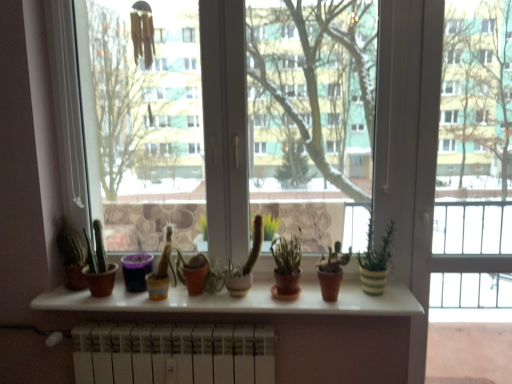
The image size is (512, 384). I want to click on matte terracotta pot at center, the 2th flowerpot when ordered from left to right, so click(195, 278).

In order to face white glossy window sill at center, should I rotate leftwards or rightwards?

You should rotate left by 4.370 degrees.

What do you see at coordinates (244, 265) in the screenshot? The width and height of the screenshot is (512, 384). I see `green matte cactus at center, which is counted as the 3th houseplant, starting from the left` at bounding box center [244, 265].

Identify the location of matte brown cactus at left, acting as the 5th houseplant starting from the right. [x=98, y=265].

From the image's perspective, is white matte radiator at lower center located beneath matte brown cactus at left, arranged as the sixth houseplant when viewed from the right?

Yes, from the image's perspective, white matte radiator at lower center is below matte brown cactus at left, arranged as the sixth houseplant when viewed from the right.

Considering the positions of objects white matte radiator at lower center and matte brown cactus at left, arranged as the sixth houseplant when viewed from the right, in the image provided, who is more to the left, white matte radiator at lower center or matte brown cactus at left, arranged as the sixth houseplant when viewed from the right,?

Positioned to the left is matte brown cactus at left, arranged as the sixth houseplant when viewed from the right.

Looking at this image, which point is more distant from viewer, (144, 353) or (69, 259)?

The point (69, 259) is behind.

Relative to matte brown cactus at left, acting as the 1th houseplant starting from the left, is white matte radiator at lower center in front or behind?

Visually, white matte radiator at lower center is located in front of matte brown cactus at left, acting as the 1th houseplant starting from the left.

Is white glossy window sill at center directly adjacent to matte brown cactus at left, acting as the 1th houseplant starting from the left?

white glossy window sill at center and matte brown cactus at left, acting as the 1th houseplant starting from the left, are not in contact.

Considering the relative sizes of white glossy window sill at center and matte brown cactus at left, acting as the 1th houseplant starting from the left, in the image provided, is white glossy window sill at center smaller than matte brown cactus at left, acting as the 1th houseplant starting from the left,?

Actually, white glossy window sill at center might be larger than matte brown cactus at left, acting as the 1th houseplant starting from the left.

Considering the relative sizes of white glossy window sill at center and matte brown cactus at left, arranged as the sixth houseplant when viewed from the right, in the image provided, is white glossy window sill at center shorter than matte brown cactus at left, arranged as the sixth houseplant when viewed from the right,?

Indeed, white glossy window sill at center has a lesser height compared to matte brown cactus at left, arranged as the sixth houseplant when viewed from the right.

Is transparent glass window at center wider or thinner than terracotta clay pot at center, which ranks as the second houseplant in right-to-left order?

In the image, transparent glass window at center appears to be more narrow than terracotta clay pot at center, which ranks as the second houseplant in right-to-left order.

Considering the relative positions of transparent glass window at center and terracotta clay pot at center, which ranks as the second houseplant in right-to-left order, in the image provided, is transparent glass window at center to the right of terracotta clay pot at center, which ranks as the second houseplant in right-to-left order, from the viewer's perspective?

Incorrect, transparent glass window at center is not on the right side of terracotta clay pot at center, which ranks as the second houseplant in right-to-left order.

Is transparent glass window at center beside terracotta clay pot at center, which is the 5th houseplant from left to right?

No.

Considering the sizes of transparent glass window at center and matte brown cactus at left, acting as the 5th houseplant starting from the right, in the image, is transparent glass window at center taller or shorter than matte brown cactus at left, acting as the 5th houseplant starting from the right,?

Considering their sizes, transparent glass window at center has more height than matte brown cactus at left, acting as the 5th houseplant starting from the right.

From the image's perspective, who appears lower, transparent glass window at center or matte brown cactus at left, acting as the 5th houseplant starting from the right?

matte brown cactus at left, acting as the 5th houseplant starting from the right, is shown below in the image.

How far apart are transparent glass window at center and matte brown cactus at left, acting as the 5th houseplant starting from the right?

transparent glass window at center and matte brown cactus at left, acting as the 5th houseplant starting from the right, are 22.10 inches apart from each other.

Would you consider transparent glass window at center to be distant from matte brown cactus at left, acting as the 5th houseplant starting from the right?

No, transparent glass window at center is not far away from matte brown cactus at left, acting as the 5th houseplant starting from the right.

Between point (254, 224) and point (59, 241), which one is positioned in front?

The point (59, 241) is more forward.

How many degrees apart are the facing directions of green matte cactus at center, which appears as the 4th houseplant when viewed from the right, and matte brown cactus at left, acting as the 1th houseplant starting from the left?

They differ by 3.57 degrees in their facing directions.

From the image's perspective, would you say green matte cactus at center, which is counted as the 3th houseplant, starting from the left, is positioned over matte brown cactus at left, acting as the 1th houseplant starting from the left?

No, from the image's perspective, green matte cactus at center, which is counted as the 3th houseplant, starting from the left, is not above matte brown cactus at left, acting as the 1th houseplant starting from the left.

From a real-world perspective, which is physically above, green matte cactus at center, which is counted as the 3th houseplant, starting from the left, or matte brown cactus at left, arranged as the sixth houseplant when viewed from the right?

green matte cactus at center, which is counted as the 3th houseplant, starting from the left, from a real-world perspective.

In the image, is matte terracotta pot at center, the 2th flowerpot when ordered from left to right, positioned in front of or behind matte brown cactus at left, the second houseplant positioned from the left?

Visually, matte terracotta pot at center, the 2th flowerpot when ordered from left to right, is located behind matte brown cactus at left, the second houseplant positioned from the left.

From the image's perspective, does matte terracotta pot at center, the 1th flowerpot from the right, appear lower than matte brown cactus at left, the second houseplant positioned from the left?

Correct, matte terracotta pot at center, the 1th flowerpot from the right, appears lower than matte brown cactus at left, the second houseplant positioned from the left, in the image.

There is a matte brown cactus at left, the second houseplant positioned from the left. What are the coordinates of `the 2nd flowerpot below it (from a real-world perspective)` in the screenshot? It's located at (195, 278).

In terms of width, does matte terracotta pot at center, the 1th flowerpot from the right, look wider or thinner when compared to matte brown cactus at left, acting as the 5th houseplant starting from the right?

matte terracotta pot at center, the 1th flowerpot from the right, is wider than matte brown cactus at left, acting as the 5th houseplant starting from the right.

From their relative heights in the image, would you say green matte cactus at center, which appears as the 4th houseplant when viewed from the right, is taller or shorter than transparent glass window at center?

Considering their sizes, green matte cactus at center, which appears as the 4th houseplant when viewed from the right, has less height than transparent glass window at center.

Measure the distance from green matte cactus at center, which is counted as the 3th houseplant, starting from the left, to transparent glass window at center.

green matte cactus at center, which is counted as the 3th houseplant, starting from the left, is 81.34 centimeters from transparent glass window at center.

From a real-world perspective, is green matte cactus at center, which is counted as the 3th houseplant, starting from the left, positioned above or below transparent glass window at center?

Result: From a real-world perspective, green matte cactus at center, which is counted as the 3th houseplant, starting from the left, is physically below transparent glass window at center.

Is the depth of green matte cactus at center, which appears as the 4th houseplant when viewed from the right, less than that of transparent glass window at center?

No, green matte cactus at center, which appears as the 4th houseplant when viewed from the right, is further to the viewer.

From the image's perspective, which houseplant is the 5th one above the white matte radiator at lower center? Please provide its 2D coordinates.

[(71, 254)]

Find the location of a particular element. The image size is (512, 384). window sill in front of the matte brown cactus at left, arranged as the sixth houseplant when viewed from the right is located at coordinates (239, 301).

Estimate the real-world distances between objects in this image. Which object is further from transparent glass window at center, white glossy window sill at center or matte terracotta pot at center, the 1th flowerpot from the right?

matte terracotta pot at center, the 1th flowerpot from the right, lies further to transparent glass window at center than the other object.

Which object lies further to the anchor point green matte cactus at center, the fourth houseplant in the left-to-right sequence, matte brown cactus at left, the second houseplant positioned from the left, or transparent glass window at center?

The object further to green matte cactus at center, the fourth houseplant in the left-to-right sequence, is transparent glass window at center.

From the image, which object appears to be nearer to matte brown cactus at left, acting as the 5th houseplant starting from the right, green matte cactus at center, which is counted as the 3th houseplant, starting from the left, or green matte cactus at center, the fourth houseplant in the left-to-right sequence?

green matte cactus at center, which is counted as the 3th houseplant, starting from the left, is positioned closer to the anchor matte brown cactus at left, acting as the 5th houseplant starting from the right.

Looking at the image, which one is located further to white glossy window sill at center, transparent glass window at center or terracotta clay pot at center, which ranks as the second houseplant in right-to-left order?

Among the two, transparent glass window at center is located further to white glossy window sill at center.

Based on their spatial positions, is white glossy window sill at center or transparent glass window at center further from green matte cactus at center, which appears as the 4th houseplant when viewed from the right?

transparent glass window at center lies further to green matte cactus at center, which appears as the 4th houseplant when viewed from the right, than the other object.

Based on their spatial positions, is white glossy window sill at center or green matte cactus at center, the fourth houseplant in the left-to-right sequence, closer to matte brown cactus at left, the second houseplant positioned from the left?

white glossy window sill at center is closer to matte brown cactus at left, the second houseplant positioned from the left.

Looking at the image, which one is located closer to transparent glass window at center, white matte radiator at lower center or green striped pot at right, marked as the 6th houseplant in a left-to-right arrangement?

Based on the image, white matte radiator at lower center appears to be nearer to transparent glass window at center.

Based on their spatial positions, is white glossy window sill at center or green matte cactus at center, which appears as the 4th houseplant when viewed from the right, closer to transparent glass window at center?

green matte cactus at center, which appears as the 4th houseplant when viewed from the right, is positioned closer to the anchor transparent glass window at center.

Locate an element on the screen. This screenshot has width=512, height=384. window screen between purple matte flowerpot at center, which ranks as the first flowerpot in left-to-right order, and terracotta clay pot at center, which ranks as the second houseplant in right-to-left order, in the horizontal direction is located at coordinates (226, 120).

I want to click on window screen between matte brown cactus at left, the second houseplant positioned from the left, and green matte cactus at center, which appears as the 4th houseplant when viewed from the right, in the horizontal direction, so click(x=226, y=120).

Where is `houseplant located between white matte radiator at lower center and green matte cactus at center, which is the 3th houseplant from right to left, in the left-right direction`? houseplant located between white matte radiator at lower center and green matte cactus at center, which is the 3th houseplant from right to left, in the left-right direction is located at coordinates (244, 265).

Where is `window screen between matte brown cactus at left, arranged as the sixth houseplant when viewed from the right, and green matte cactus at center, which is counted as the 3th houseplant, starting from the left`? This screenshot has height=384, width=512. window screen between matte brown cactus at left, arranged as the sixth houseplant when viewed from the right, and green matte cactus at center, which is counted as the 3th houseplant, starting from the left is located at coordinates point(226,120).